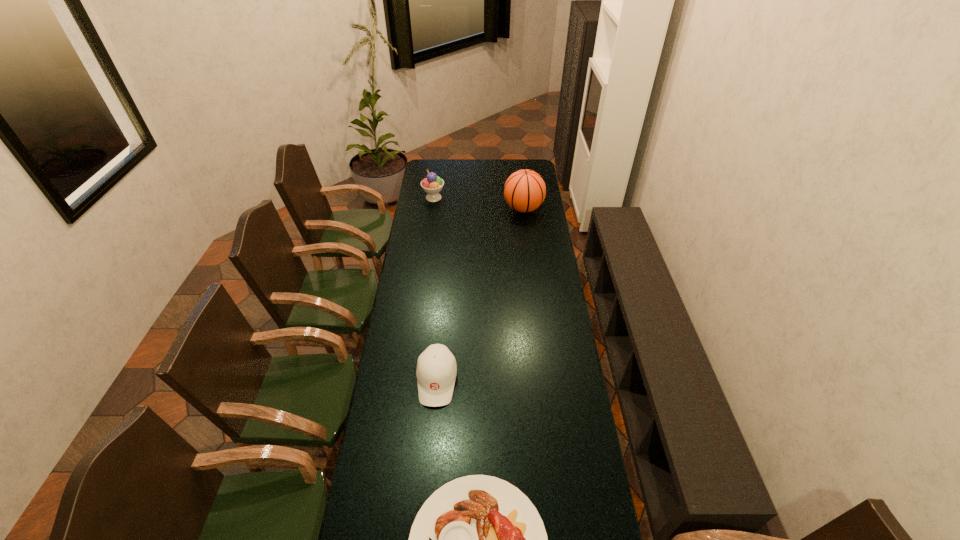
Image resolution: width=960 pixels, height=540 pixels. I want to click on basketball, so click(x=525, y=190).

I want to click on the second tallest object, so click(433, 184).

Image resolution: width=960 pixels, height=540 pixels. Find the location of `the third tallest object`. the third tallest object is located at coordinates (436, 371).

The height and width of the screenshot is (540, 960). Identify the location of baseball cap. (436, 371).

The height and width of the screenshot is (540, 960). I want to click on free point located on the left of the tallest object, so click(x=480, y=208).

This screenshot has width=960, height=540. What are the coordinates of `free spot located 0.250m on the right of the icecream` in the screenshot? It's located at (489, 198).

Locate an element on the screen. The image size is (960, 540). vacant space located 0.330m on the front-facing side of the baseball cap is located at coordinates (426, 507).

Where is `icecream located in the left edge section of the desktop`? icecream located in the left edge section of the desktop is located at coordinates (433, 184).

Where is `baseball cap at the left edge`? baseball cap at the left edge is located at coordinates (436, 371).

Locate an element on the screen. object present at the right edge is located at coordinates (525, 190).